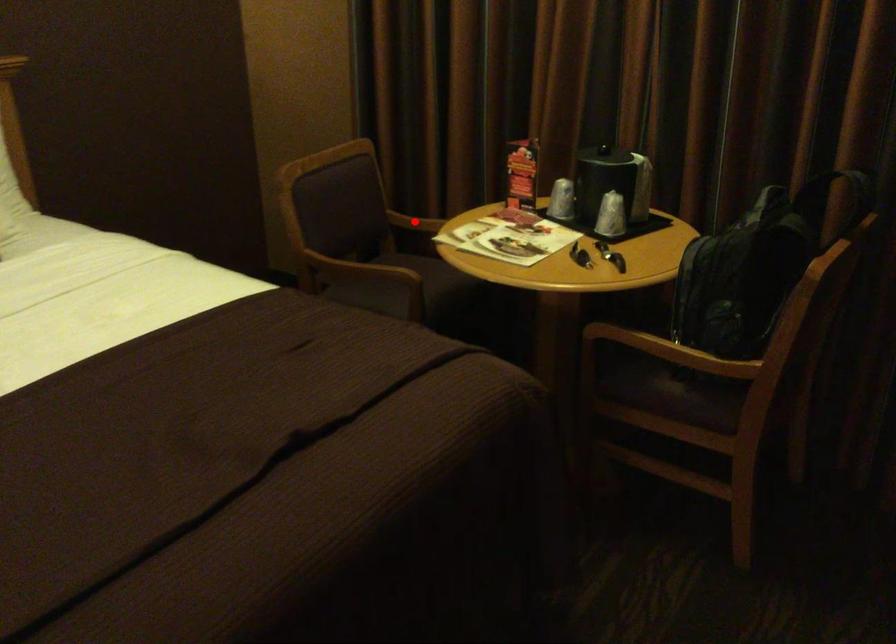
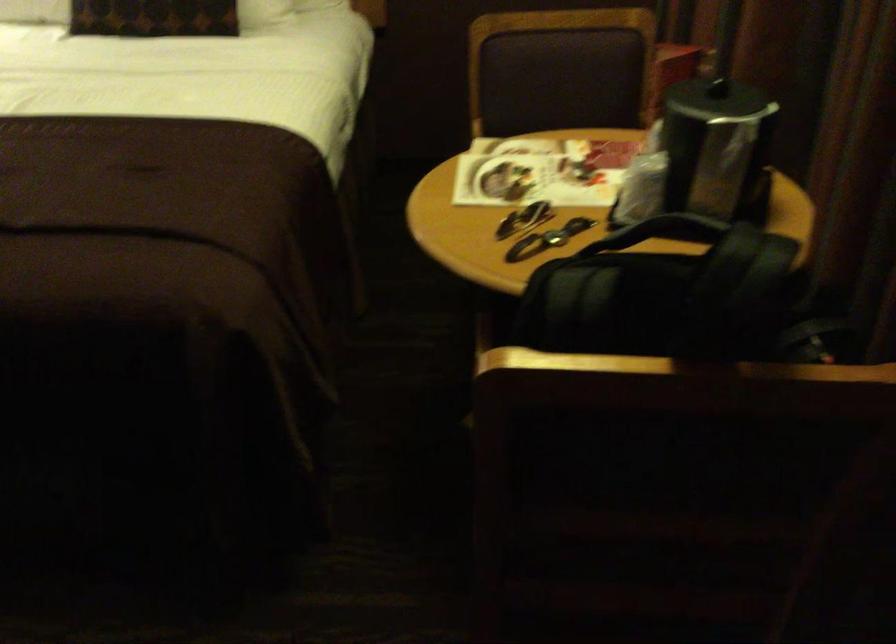
Question: I am providing you with two images of the same scene from different viewpoints. A red point is marked on the first image. Is the red point's position out of view in image 2?

Choices:
 (A) Yes
 (B) No

Answer: (A)